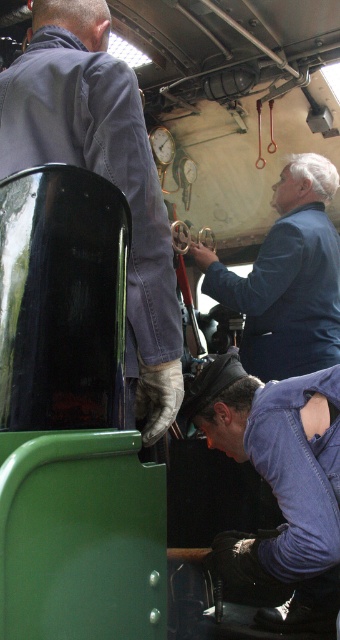
In the scene shown: Does denim jacket at upper left have a greater width compared to blue matte jacket at upper center?

No.

Which is above, denim jacket at upper left or blue matte jacket at upper center?

denim jacket at upper left is above.

Where is `denim jacket at upper left`? denim jacket at upper left is located at coordinates (102, 176).

Find the location of a particular element. denim jacket at upper left is located at coordinates [x=102, y=176].

The height and width of the screenshot is (640, 340). Find the location of `denim jacket at upper left`. denim jacket at upper left is located at coordinates (102, 176).

Does denim jacket at upper left appear on the left side of dark blue denim jeans at lower center?

Indeed, denim jacket at upper left is positioned on the left side of dark blue denim jeans at lower center.

Locate an element on the screen. denim jacket at upper left is located at coordinates (102, 176).

The width and height of the screenshot is (340, 640). What are the coordinates of `denim jacket at upper left` in the screenshot? It's located at (102, 176).

Can you confirm if dark blue denim jeans at lower center is positioned to the left of blue matte jacket at upper center?

Correct, you'll find dark blue denim jeans at lower center to the left of blue matte jacket at upper center.

Is dark blue denim jeans at lower center thinner than blue matte jacket at upper center?

Yes.

I want to click on dark blue denim jeans at lower center, so click(x=279, y=477).